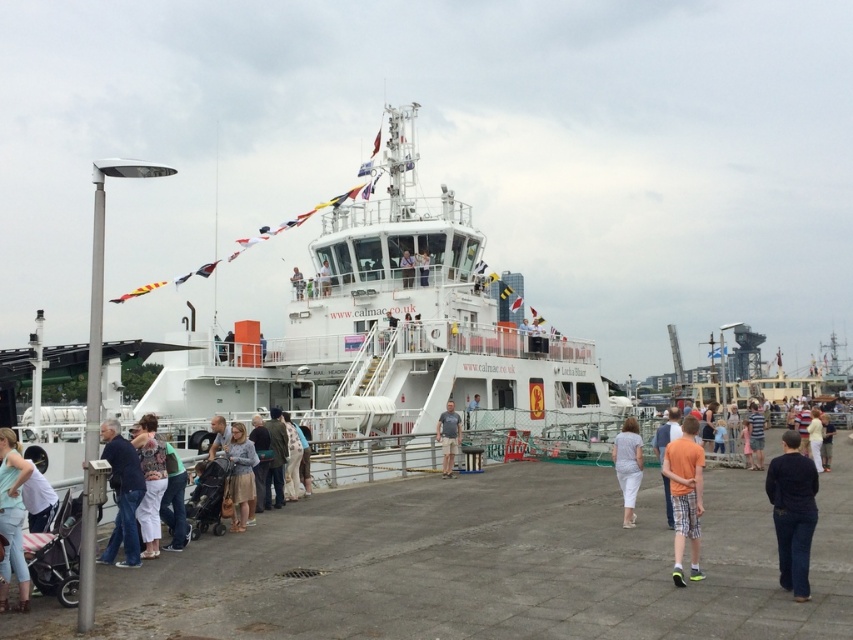
Question: Is dark blue jeans at center further to camera compared to light blue denim shorts at center?

Choices:
 (A) no
 (B) yes

Answer: (A)

Question: Which object is closer to the camera taking this photo?

Choices:
 (A) dark blue jeans at lower right
 (B) dark blue jeans at center

Answer: (B)

Question: Where is gray concrete deck at center located in relation to dark blue jeans at center in the image?

Choices:
 (A) right
 (B) left

Answer: (A)

Question: Is light gray fabric skirt at center further to the viewer compared to light blue denim shorts at center?

Choices:
 (A) no
 (B) yes

Answer: (A)

Question: Which is farther from the white cotton dress at center?

Choices:
 (A) light brown leather jacket at center
 (B) dark blue jeans at center

Answer: (A)

Question: Which point is closer to the camera taking this photo?

Choices:
 (A) (780, 467)
 (B) (296, 294)

Answer: (A)